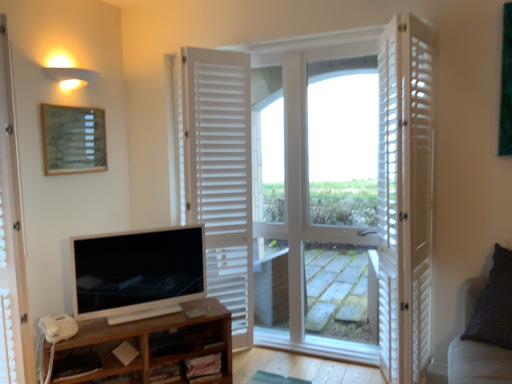
Question: Is there a large distance between white wooden door at center, placed as the 3th door when sorted from right to left, and brown wood shelf at lower left?

Choices:
 (A) no
 (B) yes

Answer: (A)

Question: Is white wooden door at center, placed as the 3th door when sorted from right to left, shorter than brown wood shelf at lower left?

Choices:
 (A) yes
 (B) no

Answer: (B)

Question: Considering the relative positions of white wooden door at center, placed as the 3th door when sorted from right to left, and brown wood shelf at lower left in the image provided, is white wooden door at center, placed as the 3th door when sorted from right to left, to the right of brown wood shelf at lower left from the viewer's perspective?

Choices:
 (A) yes
 (B) no

Answer: (A)

Question: Is white wooden door at center, the first door in the left-to-right sequence, wider than brown wood shelf at lower left?

Choices:
 (A) yes
 (B) no

Answer: (A)

Question: Is white wooden door at center, placed as the 3th door when sorted from right to left, thinner than brown wood shelf at lower left?

Choices:
 (A) no
 (B) yes

Answer: (A)

Question: From the image's perspective, relative to dark gray fabric couch at right, is white wooden door at center, acting as the 2th door starting from the right, above or below?

Choices:
 (A) below
 (B) above

Answer: (B)

Question: From a real-world perspective, is white wooden door at center, acting as the 2th door starting from the right, positioned above or below dark gray fabric couch at right?

Choices:
 (A) below
 (B) above

Answer: (B)

Question: Is white wooden door at center, acting as the 2th door starting from the right, bigger or smaller than dark gray fabric couch at right?

Choices:
 (A) small
 (B) big

Answer: (B)

Question: Which is correct: white wooden door at center, acting as the 2th door starting from the right, is inside dark gray fabric couch at right, or outside of it?

Choices:
 (A) outside
 (B) inside

Answer: (A)

Question: Based on their sizes in the image, would you say white glossy television at lower left is bigger or smaller than white wooden door at right, which is the first door in right-to-left order?

Choices:
 (A) big
 (B) small

Answer: (B)

Question: Would you say white glossy television at lower left is to the left or to the right of white wooden door at right, which is the first door in right-to-left order, in the picture?

Choices:
 (A) right
 (B) left

Answer: (B)

Question: Relative to white wooden door at right, the third door positioned from the left, is white glossy television at lower left in front or behind?

Choices:
 (A) behind
 (B) front

Answer: (A)

Question: From the image's perspective, is white glossy television at lower left above or below white wooden door at right, which is the first door in right-to-left order?

Choices:
 (A) above
 (B) below

Answer: (B)

Question: In the image, is white wooden door at center, acting as the 2th door starting from the right, on the left side or the right side of brown wood shelf at lower left?

Choices:
 (A) right
 (B) left

Answer: (A)

Question: Considering the positions of white wooden door at center, arranged as the second door when viewed from the left, and brown wood shelf at lower left in the image, is white wooden door at center, arranged as the second door when viewed from the left, taller or shorter than brown wood shelf at lower left?

Choices:
 (A) tall
 (B) short

Answer: (A)